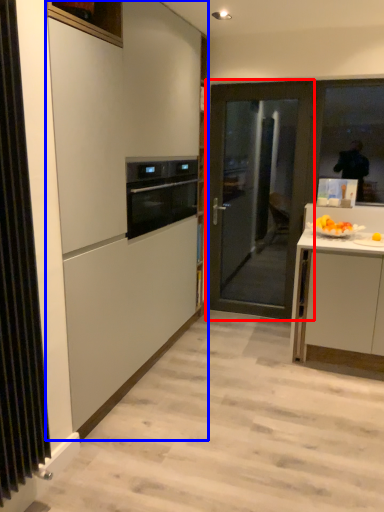
Question: Which object appears farthest to the camera in this image, door (highlighted by a red box) or cabinetry (highlighted by a blue box)?

Choices:
 (A) door
 (B) cabinetry

Answer: (A)